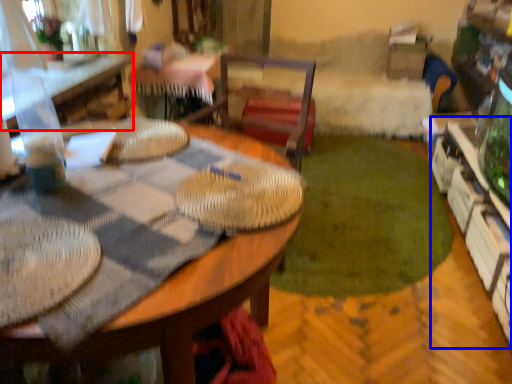
Question: Which point is further to the camera, table (highlighted by a red box) or shelf (highlighted by a blue box)?

Choices:
 (A) table
 (B) shelf

Answer: (A)